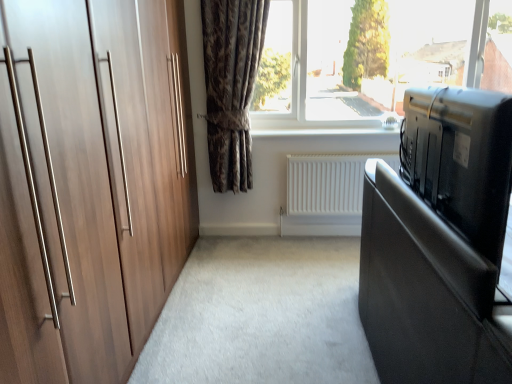
Question: Is dark brown textured curtain at center surrounding black glossy tv at right?

Choices:
 (A) no
 (B) yes

Answer: (A)

Question: Is dark brown textured curtain at center facing away from black glossy tv at right?

Choices:
 (A) yes
 (B) no

Answer: (B)

Question: Can you confirm if dark brown textured curtain at center is bigger than black glossy tv at right?

Choices:
 (A) yes
 (B) no

Answer: (B)

Question: Are dark brown textured curtain at center and black glossy tv at right located far from each other?

Choices:
 (A) no
 (B) yes

Answer: (B)

Question: Does dark brown textured curtain at center appear on the left side of black glossy tv at right?

Choices:
 (A) no
 (B) yes

Answer: (B)

Question: Is white matte radiator at center inside the boundaries of transparent glass window at upper center, or outside?

Choices:
 (A) outside
 (B) inside

Answer: (A)

Question: From the image's perspective, is white matte radiator at center located above or below transparent glass window at upper center?

Choices:
 (A) below
 (B) above

Answer: (A)

Question: Relative to transparent glass window at upper center, is white matte radiator at center in front or behind?

Choices:
 (A) front
 (B) behind

Answer: (B)

Question: From a real-world perspective, is white matte radiator at center above or below transparent glass window at upper center?

Choices:
 (A) below
 (B) above

Answer: (A)

Question: Relative to white matte radiator at center, is dark brown textured curtain at center in front or behind?

Choices:
 (A) front
 (B) behind

Answer: (A)

Question: From the image's perspective, relative to white matte radiator at center, is dark brown textured curtain at center above or below?

Choices:
 (A) above
 (B) below

Answer: (A)

Question: Considering the positions of dark brown textured curtain at center and white matte radiator at center in the image, is dark brown textured curtain at center bigger or smaller than white matte radiator at center?

Choices:
 (A) big
 (B) small

Answer: (A)

Question: From a real-world perspective, is dark brown textured curtain at center physically located above or below white matte radiator at center?

Choices:
 (A) above
 (B) below

Answer: (A)

Question: From a real-world perspective, is smooth black bed at right above or below white matte radiator at center?

Choices:
 (A) below
 (B) above

Answer: (A)

Question: From the image's perspective, is smooth black bed at right above or below white matte radiator at center?

Choices:
 (A) above
 (B) below

Answer: (B)